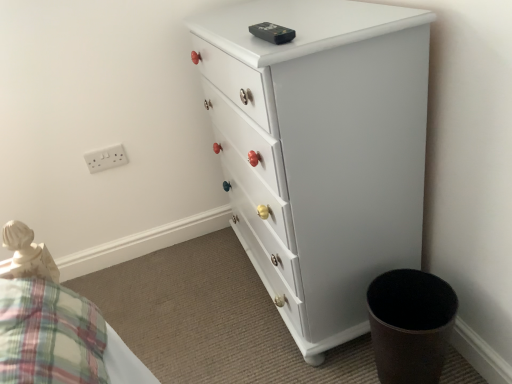
Describe the element at coordinates (106, 158) in the screenshot. I see `white plastic outlet at upper left` at that location.

The height and width of the screenshot is (384, 512). Find the location of `white plastic outlet at upper left`. white plastic outlet at upper left is located at coordinates (106, 158).

What is the approximate height of white plastic outlet at upper left?

The height of white plastic outlet at upper left is 9.05 centimeters.

What do you see at coordinates (320, 151) in the screenshot? I see `white painted wood chest of drawers at center` at bounding box center [320, 151].

The height and width of the screenshot is (384, 512). Find the location of `white painted wood chest of drawers at center`. white painted wood chest of drawers at center is located at coordinates (320, 151).

Identify the location of white plastic outlet at upper left. (106, 158).

Which object is positioned more to the right, white plastic outlet at upper left or white painted wood chest of drawers at center?

From the viewer's perspective, white painted wood chest of drawers at center appears more on the right side.

Relative to white painted wood chest of drawers at center, is white plastic outlet at upper left in front or behind?

white plastic outlet at upper left is behind white painted wood chest of drawers at center.

Which is farther, (91,171) or (265,186)?

The point (91,171) is farther.

From the image's perspective, is white plastic outlet at upper left beneath white painted wood chest of drawers at center?

No, from the image's perspective, white plastic outlet at upper left is not below white painted wood chest of drawers at center.

Based on the photo, from a real-world perspective, between white plastic outlet at upper left and white painted wood chest of drawers at center, who is vertically lower?

From a 3D spatial view, white painted wood chest of drawers at center is below.

Looking at this image, is white plastic outlet at upper left thinner than white painted wood chest of drawers at center?

Yes.

Considering the sizes of white plastic outlet at upper left and white painted wood chest of drawers at center in the image, is white plastic outlet at upper left taller or shorter than white painted wood chest of drawers at center?

white plastic outlet at upper left is shorter than white painted wood chest of drawers at center.

In terms of size, does white plastic outlet at upper left appear bigger or smaller than white painted wood chest of drawers at center?

Considering their sizes, white plastic outlet at upper left takes up less space than white painted wood chest of drawers at center.

Is white plastic outlet at upper left not within white painted wood chest of drawers at center?

Yes.

Is white plastic outlet at upper left with white painted wood chest of drawers at center?

No, white plastic outlet at upper left is not in contact with white painted wood chest of drawers at center.

Is white plastic outlet at upper left aimed at white painted wood chest of drawers at center?

No, white plastic outlet at upper left does not turn towards white painted wood chest of drawers at center.

How different are the orientations of white plastic outlet at upper left and white painted wood chest of drawers at center in degrees?

89.4 degrees.

At what (x,y) coordinates should I click in order to perform the action: click on the chest of drawers that is in front of the white plastic outlet at upper left. Please return your answer as a coordinate pair (x, y). The width and height of the screenshot is (512, 384). Looking at the image, I should click on (320, 151).

Between white painted wood chest of drawers at center and white plastic outlet at upper left, which one appears on the left side from the viewer's perspective?

white plastic outlet at upper left.

Relative to white plastic outlet at upper left, is white painted wood chest of drawers at center in front or behind?

In the image, white painted wood chest of drawers at center appears in front of white plastic outlet at upper left.

Is point (404, 85) less distant than point (93, 168)?

Yes, it is.

From the image's perspective, which object appears higher, white painted wood chest of drawers at center or white plastic outlet at upper left?

white plastic outlet at upper left is shown above in the image.

From a real-world perspective, is white painted wood chest of drawers at center physically located above or below white plastic outlet at upper left?

From a real-world perspective, white painted wood chest of drawers at center is physically below white plastic outlet at upper left.

Consider the image. Is white painted wood chest of drawers at center thinner than white plastic outlet at upper left?

No, white painted wood chest of drawers at center is not thinner than white plastic outlet at upper left.

Who is shorter, white painted wood chest of drawers at center or white plastic outlet at upper left?

white plastic outlet at upper left.

Between white painted wood chest of drawers at center and white plastic outlet at upper left, which one has smaller size?

With smaller size is white plastic outlet at upper left.

Do you think white painted wood chest of drawers at center is within white plastic outlet at upper left, or outside of it?

white painted wood chest of drawers at center is spatially situated outside white plastic outlet at upper left.

Is white painted wood chest of drawers at center next to white plastic outlet at upper left?

white painted wood chest of drawers at center is not next to white plastic outlet at upper left, and they're not touching.

Is white painted wood chest of drawers at center facing away from white plastic outlet at upper left?

No, white painted wood chest of drawers at center is not facing the opposite direction of white plastic outlet at upper left.

Can you tell me how much white painted wood chest of drawers at center and white plastic outlet at upper left differ in facing direction?

The angular difference between white painted wood chest of drawers at center and white plastic outlet at upper left is 89.4 degrees.

Measure the distance between white painted wood chest of drawers at center and white plastic outlet at upper left.

A distance of 35.86 inches exists between white painted wood chest of drawers at center and white plastic outlet at upper left.

You are a GUI agent. You are given a task and a screenshot of the screen. Output one action in this format:
    pyautogui.click(x=<x>, y=<y>)
    Task: Click on the electric outlet located behind the white painted wood chest of drawers at center
    This screenshot has width=512, height=384.
    Given the screenshot: What is the action you would take?
    pyautogui.click(x=106, y=158)

Find the location of a particular element. The height and width of the screenshot is (384, 512). the chest of drawers lying below the white plastic outlet at upper left (from the image's perspective) is located at coordinates (320, 151).

Identify the location of the chest of drawers below the white plastic outlet at upper left (from a real-world perspective). (320, 151).